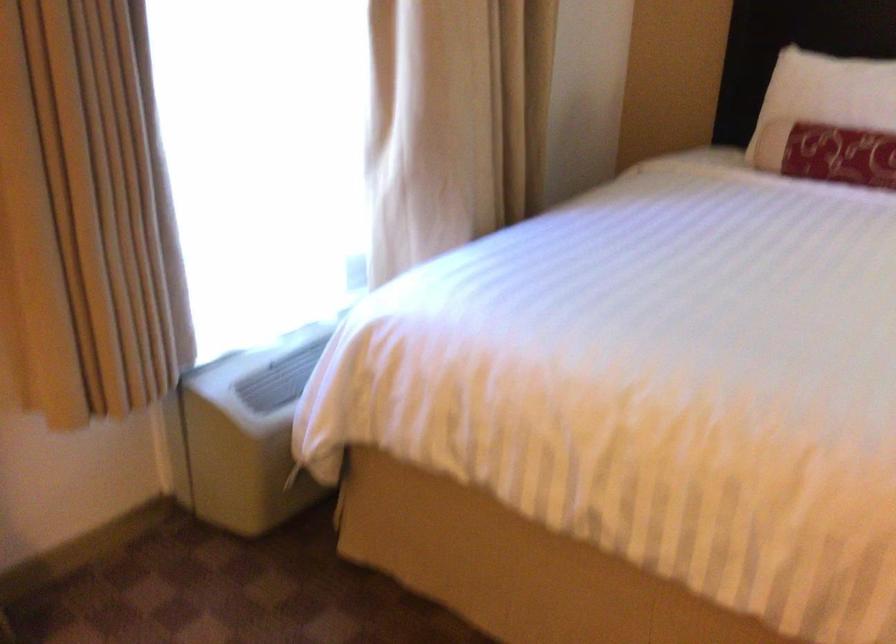
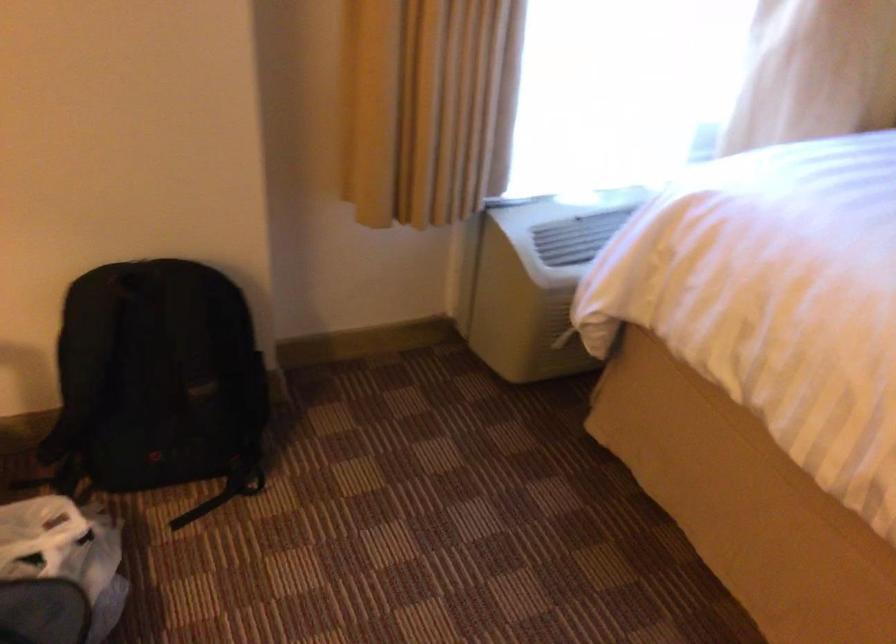
Question: The camera is either moving clockwise (left) or counter-clockwise (right) around the object. The first image is from the beginning of the video and the second image is from the end. Is the camera moving left or right when shooting the video?

Choices:
 (A) Left
 (B) Right

Answer: (B)